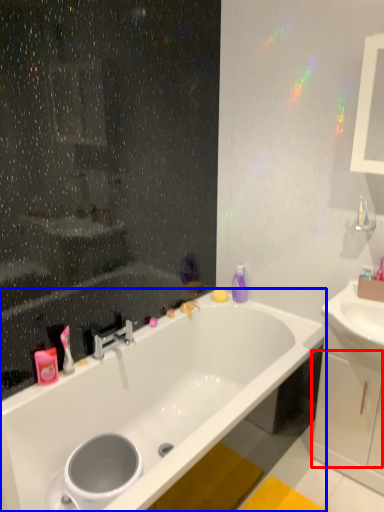
Question: Which object appears closest to the camera in this image, drawer (highlighted by a red box) or bathtub (highlighted by a blue box)?

Choices:
 (A) drawer
 (B) bathtub

Answer: (B)